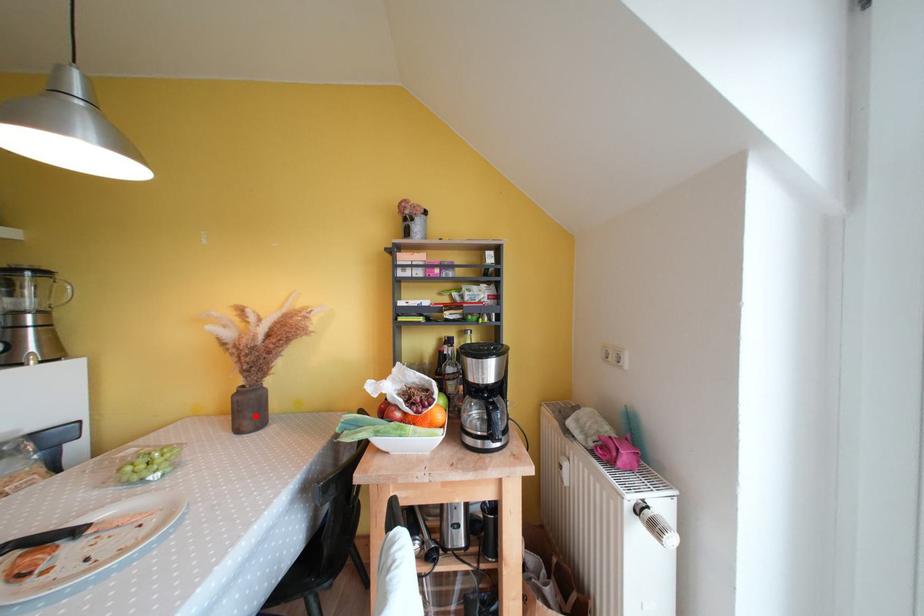
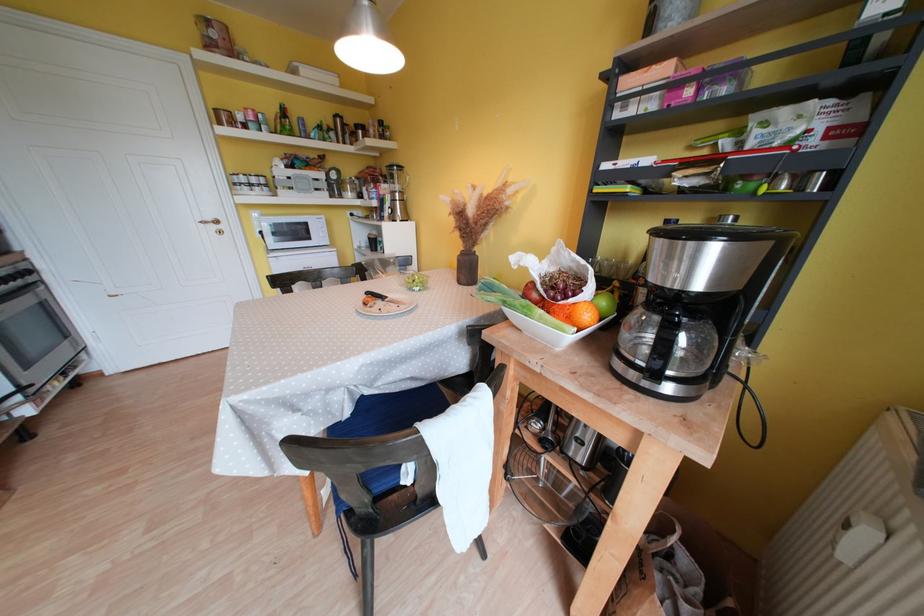
Question: I am providing you with two images of the same scene from different viewpoints. A red point is marked on the first image. Can you still see the location of the red point in image 2?

Choices:
 (A) Yes
 (B) No

Answer: (A)